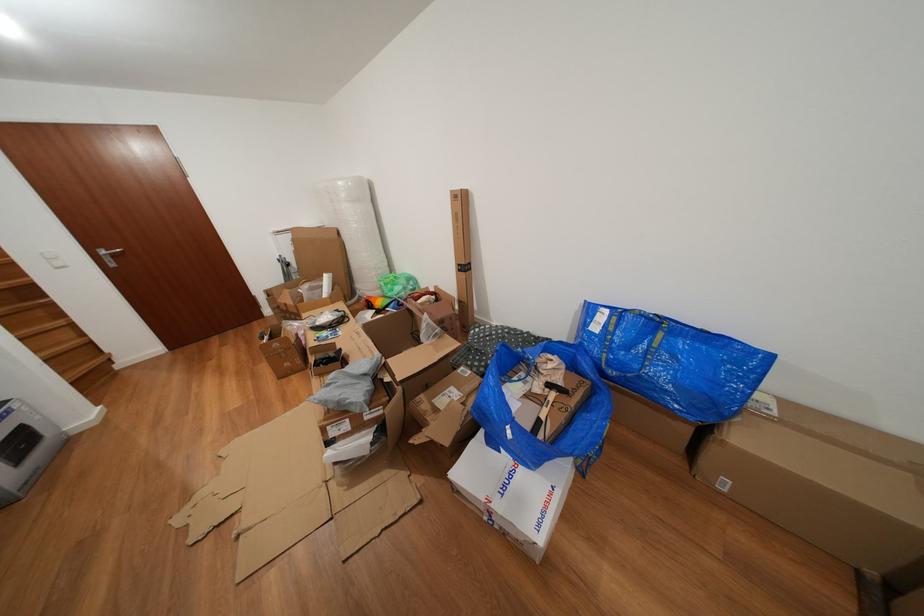
Which object does [513,493] point to?

It refers to a white cardboard box.